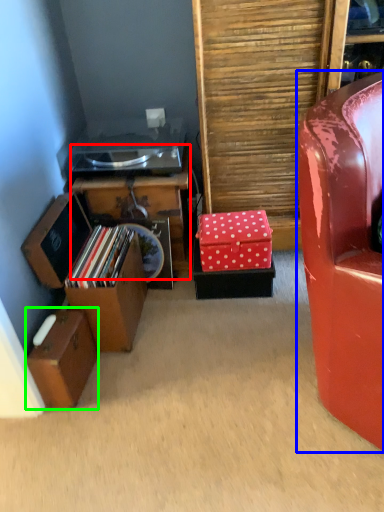
Question: Considering the real-world distances, which object is farthest from furniture (highlighted by a red box)? chair (highlighted by a blue box) or storage box (highlighted by a green box)?

Choices:
 (A) chair
 (B) storage box

Answer: (A)